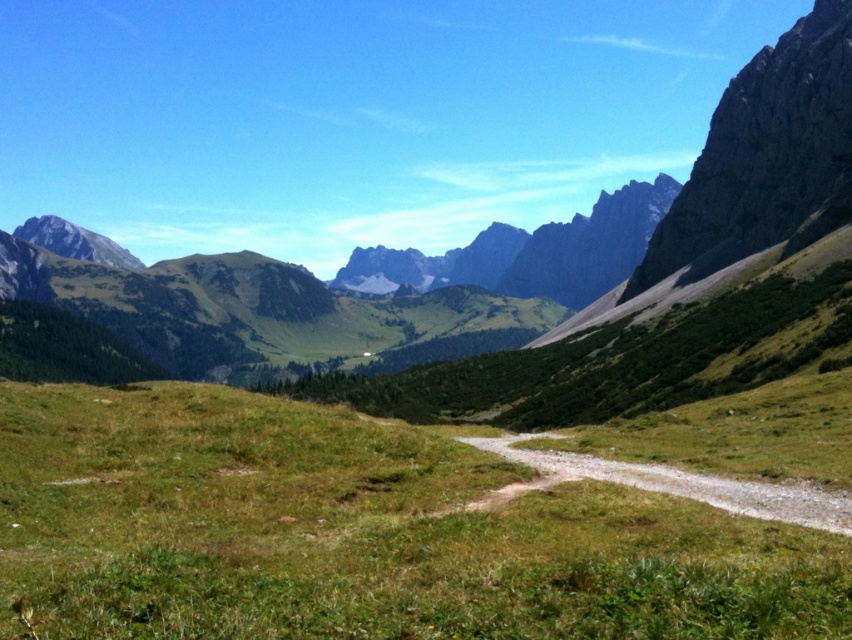
Can you confirm if green grassy at center is bigger than dirt/gravel trail at center?

Indeed, green grassy at center has a larger size compared to dirt/gravel trail at center.

Can you confirm if green grassy at center is wider than dirt/gravel trail at center?

Indeed, green grassy at center has a greater width compared to dirt/gravel trail at center.

I want to click on green grassy at center, so click(x=357, y=532).